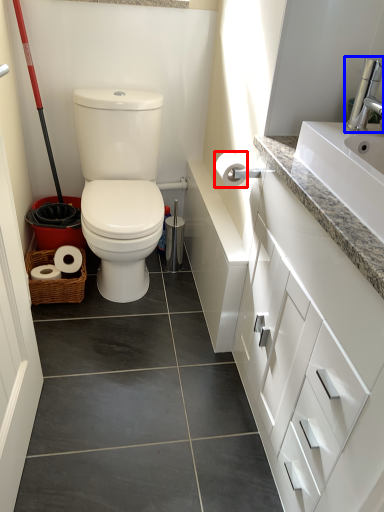
Question: Which point is closer to the camera, toilet paper (highlighted by a red box) or faucet (highlighted by a blue box)?

Choices:
 (A) toilet paper
 (B) faucet

Answer: (B)